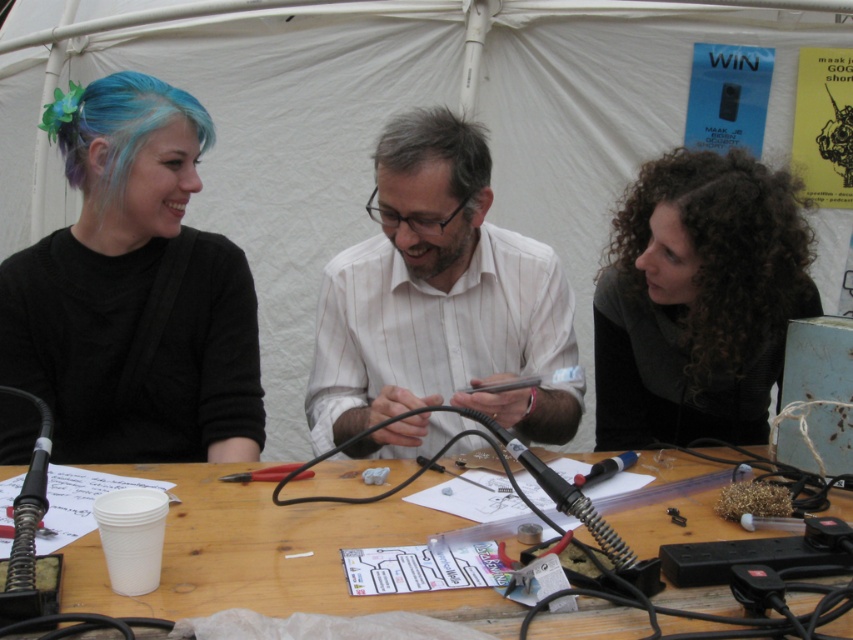
Question: Among these objects, which one is nearest to the camera?

Choices:
 (A) white striped shirt at center
 (B) black matte hair at left
 (C) blue dyed hair at upper left
 (D) gray matte hair at center

Answer: (A)

Question: Is black matte hair at left to the right of blue dyed hair at upper left from the viewer's perspective?

Choices:
 (A) yes
 (B) no

Answer: (A)

Question: Among these objects, which one is farthest from the camera?

Choices:
 (A) white striped shirt at center
 (B) gray matte hair at center

Answer: (B)

Question: Which is nearer to the curly hair at upper right?

Choices:
 (A) wooden table at center
 (B) white striped shirt at center
 (C) blue dyed hair at upper left
 (D) gray matte hair at center

Answer: (B)

Question: Does white striped shirt at center appear under curly hair at upper right?

Choices:
 (A) yes
 (B) no

Answer: (B)

Question: Is wooden table at center wider than gray matte hair at center?

Choices:
 (A) no
 (B) yes

Answer: (B)